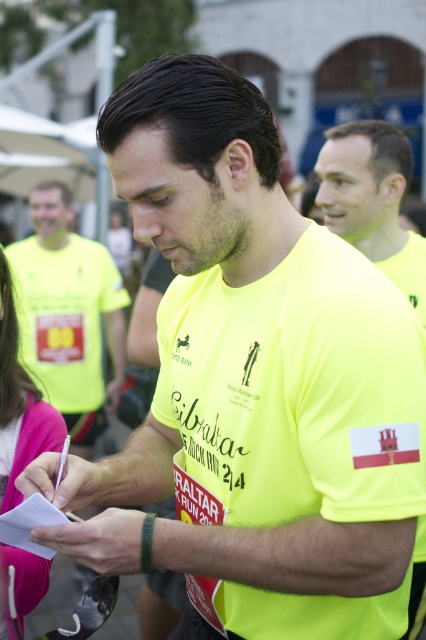
Looking at this image, you are a photographer at the event and need to capture both the yellow matte shirt at upper center and the pink fabric at lower left in a single frame. Which object should you focus on first to ensure both are in the frame?

The yellow matte shirt at upper center is bigger than the pink fabric at lower left, so you should focus on the yellow matte shirt at upper center first to ensure both are in the frame.